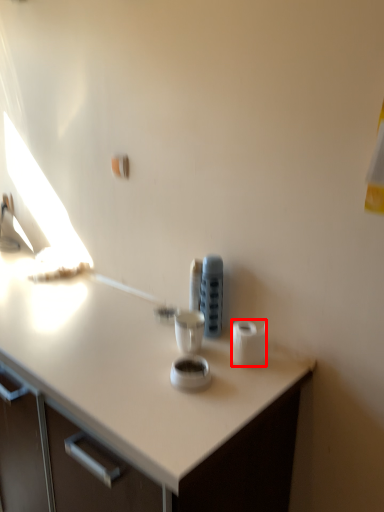
Question: Considering the relative positions of toilet paper (annotated by the red box) and appliance in the image provided, where is toilet paper (annotated by the red box) located with respect to the staircase?

Choices:
 (A) right
 (B) left

Answer: (A)